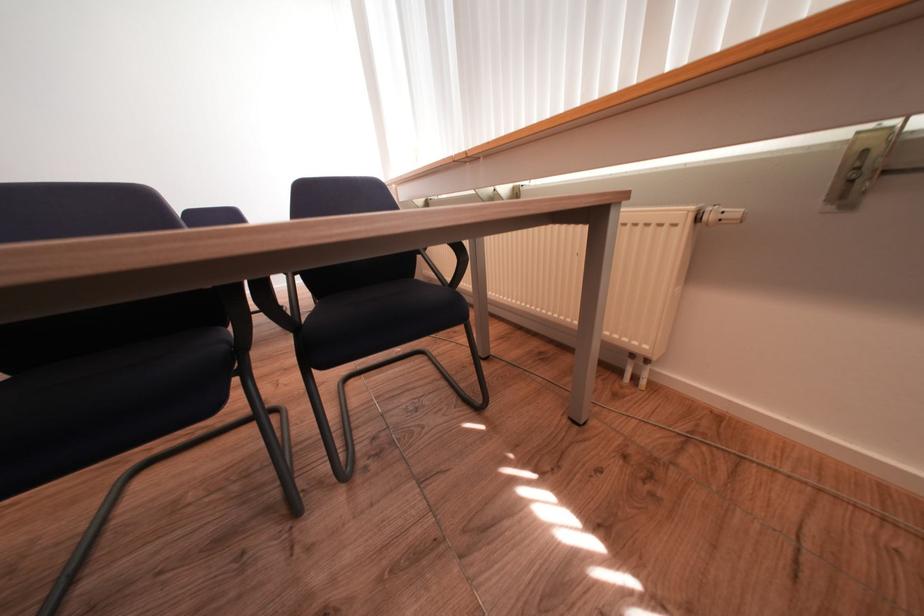
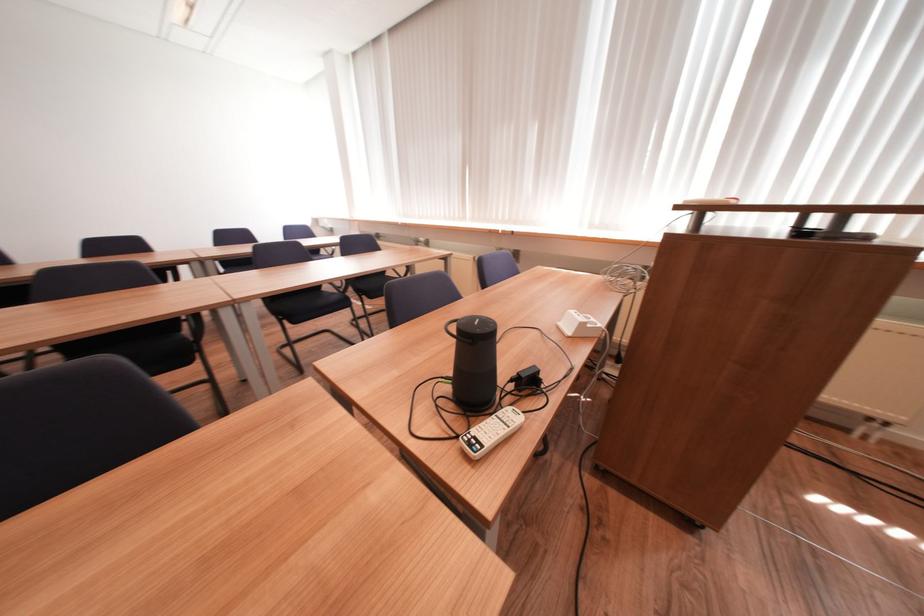
Question: Which direction would the cameraman need to move to produce the second image? Reply with the corresponding letter.

Choices:
 (A) Left
 (B) Right
 (C) Forward
 (D) Backward

Answer: (D)